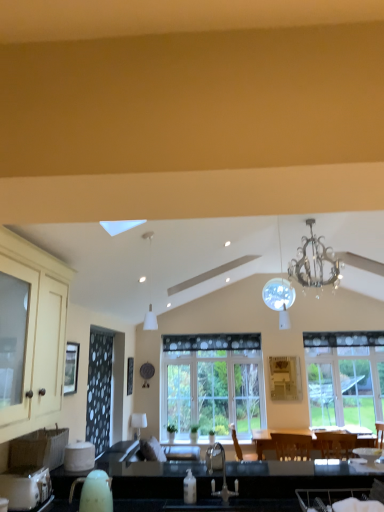
Question: Can you confirm if matte cream cabinet at left is thinner than clear glass window at center, which is the 2th window in left-to-right order?

Choices:
 (A) yes
 (B) no

Answer: (B)

Question: Is matte cream cabinet at left in contact with clear glass window at center, which ranks as the 1th window in right-to-left order?

Choices:
 (A) no
 (B) yes

Answer: (A)

Question: Does matte cream cabinet at left have a lesser height compared to clear glass window at center, which is the 2th window in left-to-right order?

Choices:
 (A) yes
 (B) no

Answer: (A)

Question: Is clear glass window at center, which ranks as the 1th window in right-to-left order, surrounded by matte cream cabinet at left?

Choices:
 (A) no
 (B) yes

Answer: (A)

Question: Is matte cream cabinet at left looking in the opposite direction of clear glass window at center, which is the 2th window in left-to-right order?

Choices:
 (A) no
 (B) yes

Answer: (A)

Question: Considering the relative sizes of matte cream cabinet at left and clear glass window at center, which is the 2th window in left-to-right order, in the image provided, is matte cream cabinet at left wider than clear glass window at center, which is the 2th window in left-to-right order,?

Choices:
 (A) yes
 (B) no

Answer: (A)

Question: Is velvet dark brown armchair at lower right not close to clear glass window at center, the 2th window when ordered from right to left?

Choices:
 (A) yes
 (B) no

Answer: (A)

Question: Is clear glass window at center, the 1th window in the left-to-right sequence, inside velvet dark brown armchair at lower right?

Choices:
 (A) no
 (B) yes

Answer: (A)

Question: Is velvet dark brown armchair at lower right wider than clear glass window at center, the 1th window in the left-to-right sequence?

Choices:
 (A) no
 (B) yes

Answer: (B)

Question: Considering the relative sizes of velvet dark brown armchair at lower right and clear glass window at center, the 2th window when ordered from right to left, in the image provided, is velvet dark brown armchair at lower right shorter than clear glass window at center, the 2th window when ordered from right to left,?

Choices:
 (A) yes
 (B) no

Answer: (A)

Question: From a real-world perspective, does velvet dark brown armchair at lower right stand above clear glass window at center, the 1th window in the left-to-right sequence?

Choices:
 (A) yes
 (B) no

Answer: (B)

Question: Is velvet dark brown armchair at lower right looking in the opposite direction of clear glass window at center, the 2th window when ordered from right to left?

Choices:
 (A) no
 (B) yes

Answer: (B)

Question: Is the position of silver metallic chandelier at upper center, marked as the second light fixture in a front-to-back arrangement, less distant than that of clear glass window screen at left?

Choices:
 (A) yes
 (B) no

Answer: (B)